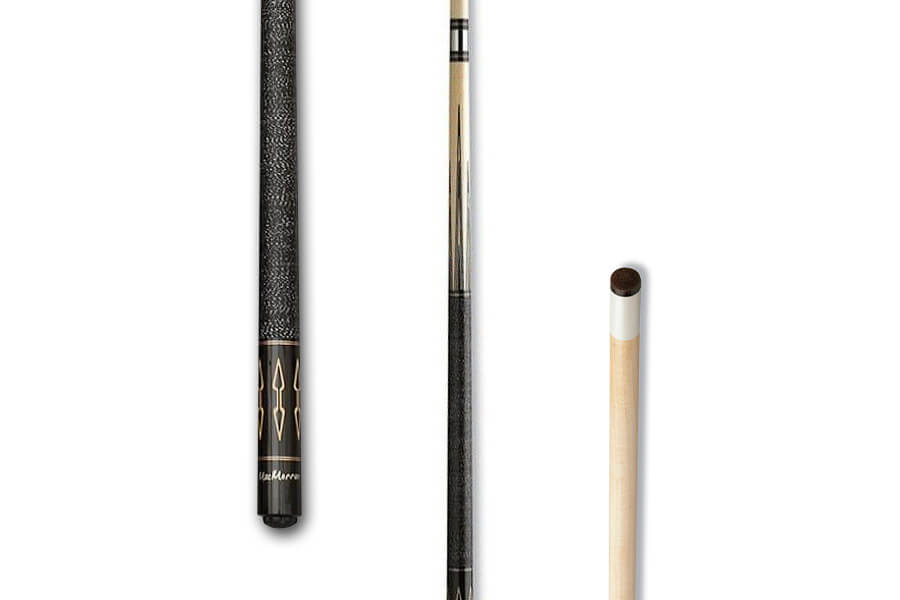
Find the location of `pool cue handle`. pool cue handle is located at coordinates (283, 389).